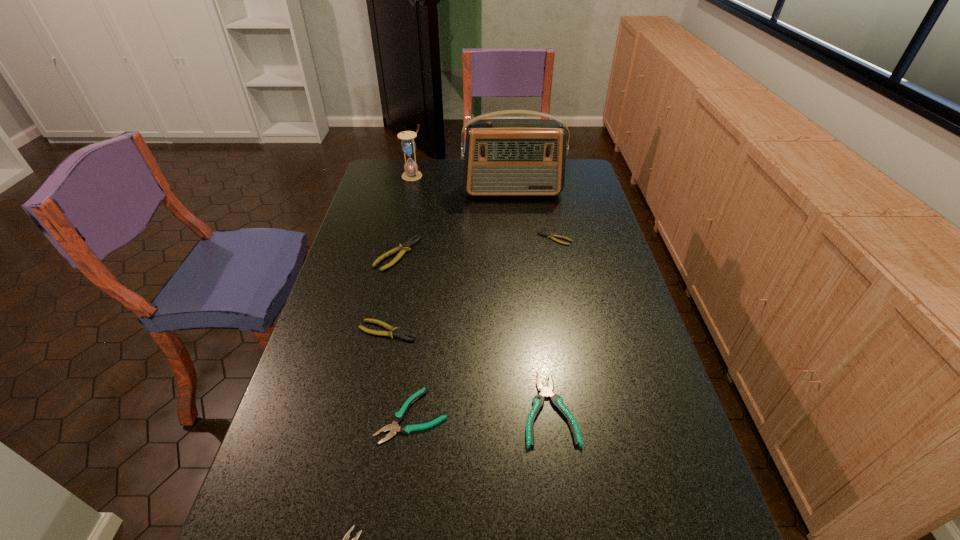
Where is `radio receiver`? This screenshot has height=540, width=960. radio receiver is located at coordinates (503, 157).

Image resolution: width=960 pixels, height=540 pixels. Identify the location of the seventh nearest object. (503, 157).

Find the location of a particular element. Image resolution: width=960 pixels, height=540 pixels. the second tallest object is located at coordinates (408, 145).

I want to click on white hourglass, so click(408, 145).

At what (x,y) coordinates should I click in order to perform the action: click on the sixth shortest object. Please return your answer as a coordinate pair (x, y). The width and height of the screenshot is (960, 540). Looking at the image, I should click on (404, 248).

In order to click on the tallest pliers in this screenshot , I will do `click(404, 248)`.

The width and height of the screenshot is (960, 540). I want to click on the rightmost teal pliers, so click(545, 391).

Where is `the fifth farthest object`? the fifth farthest object is located at coordinates point(390,333).

This screenshot has height=540, width=960. What are the coordinates of `the nearest yellow pliers` in the screenshot? It's located at coord(390,333).

Where is `the second biggest teal pliers`? the second biggest teal pliers is located at coordinates (398, 417).